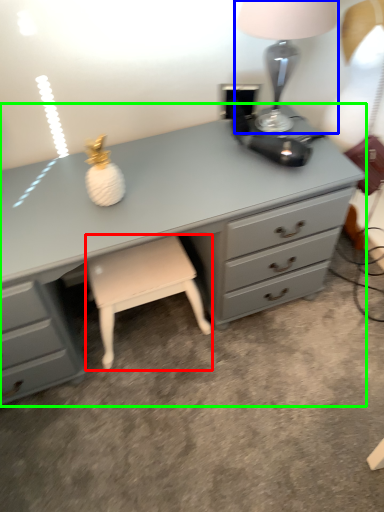
Question: Based on their relative distances, which object is nearer to stool (highlighted by a red box)? Choose from table lamp (highlighted by a blue box) and chest of drawers (highlighted by a green box).

Choices:
 (A) table lamp
 (B) chest of drawers

Answer: (B)